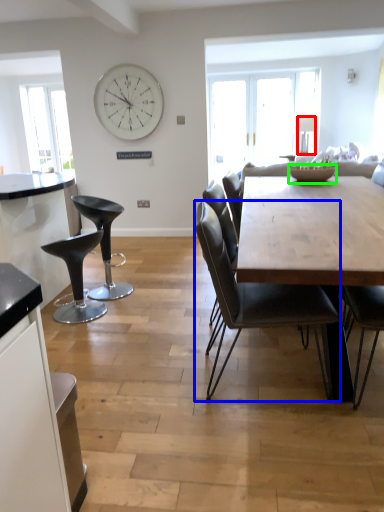
Question: Which object is positioned farthest from lamp (highlighted by a red box)? Select from chair (highlighted by a blue box) and bowl (highlighted by a green box).

Choices:
 (A) chair
 (B) bowl

Answer: (A)